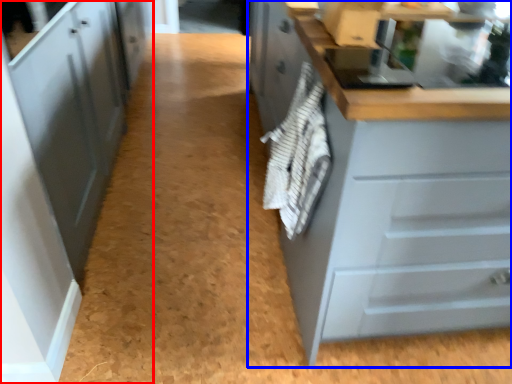
Question: Which object is closer to the camera taking this photo, cabinetry (highlighted by a red box) or cabinetry (highlighted by a blue box)?

Choices:
 (A) cabinetry
 (B) cabinetry

Answer: (B)